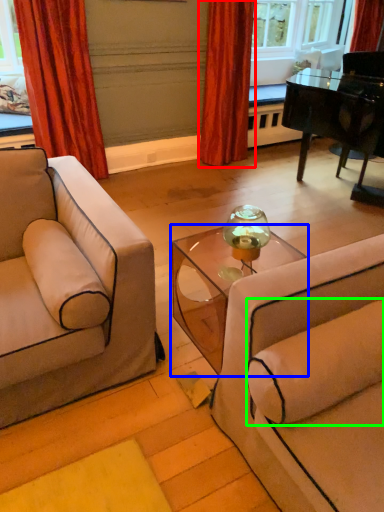
Question: Based on their relative distances, which object is nearer to curtain (highlighted by a red box)? Choose from table (highlighted by a blue box) and pillow (highlighted by a green box).

Choices:
 (A) table
 (B) pillow

Answer: (A)